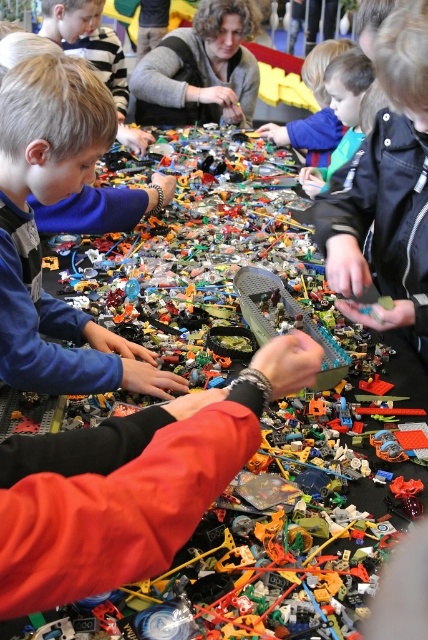
Where is the blue matte shirt at left located in the image?

The blue matte shirt at left is located at point (427, 639) in the image.

You are a parent standing at the edge of the table where the LEGO activity is happening. You see the green matte toy car at center on the table. If you want to hand a LEGO piece to your child who is sitting directly across from you, will you be able to reach them without moving your hand beyond the table edge?

The green matte toy car at center and viewer are 34.06 inches apart from each other. Since the distance between you and the toy car is 34.06 inches, and assuming the table length allows reaching across, you might be able to reach your child depending on your arm length. However, the question specifies not moving beyond the table edge, so if the child is sitting across, the distance may require extending your arm fully. The answer should strictly use the given data. Since the toy car is 34.06 inches away, if

You are a photographer trying to capture the entire scene of the LEGO build session. You notice the blue matte shirt at left and the matte gray sweater at upper center. Which of these two items should you adjust your camera angle to ensure both are fully visible in the frame?

The blue matte shirt at left is much taller than the matte gray sweater at upper center, so you should adjust the camera angle to account for the height of the blue matte shirt at left to ensure both are fully visible.